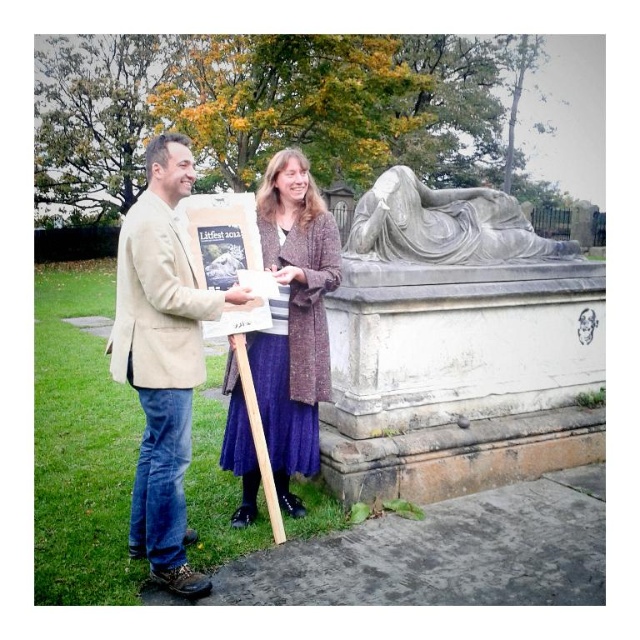
Can you confirm if beige fabric jacket at center is shorter than white marble statue at right?

Yes.

Find the location of a particular element. This screenshot has height=640, width=640. beige fabric jacket at center is located at coordinates (163, 358).

Locate an element on the screen. beige fabric jacket at center is located at coordinates (163, 358).

Who is positioned more to the left, beige fabric jacket at center or velvet purple skirt at center?

beige fabric jacket at center is more to the left.

Can you confirm if beige fabric jacket at center is thinner than velvet purple skirt at center?

Indeed, beige fabric jacket at center has a lesser width compared to velvet purple skirt at center.

Is point (156, 294) farther from camera compared to point (268, 192)?

No, it is not.

At what (x,y) coordinates should I click in order to perform the action: click on beige fabric jacket at center. Please return your answer as a coordinate pair (x, y). The height and width of the screenshot is (640, 640). Looking at the image, I should click on (163, 358).

Is velvet purple skirt at center below white marble statue at right?

Indeed, velvet purple skirt at center is positioned under white marble statue at right.

Based on the photo, is velvet purple skirt at center above white marble statue at right?

Actually, velvet purple skirt at center is below white marble statue at right.

You are a GUI agent. You are given a task and a screenshot of the screen. Output one action in this format:
    pyautogui.click(x=<x>, y=<y>)
    Task: Click on the velvet purple skirt at center
    
    Given the screenshot: What is the action you would take?
    pyautogui.click(x=292, y=320)

In order to click on velvet purple skirt at center in this screenshot , I will do `click(292, 320)`.